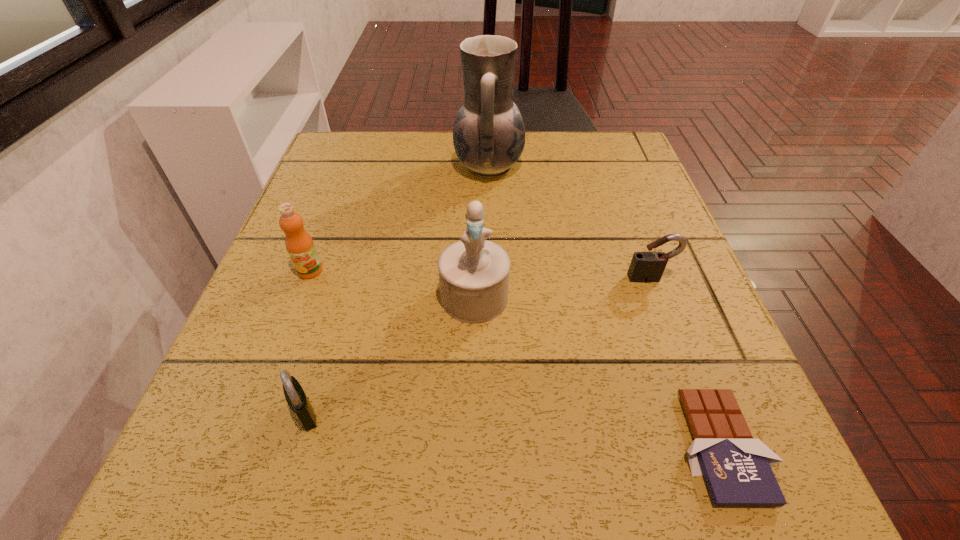
Locate an element on the screen. The width and height of the screenshot is (960, 540). free area in between the right padlock and the pitcher is located at coordinates (569, 222).

The image size is (960, 540). What are the coordinates of `blank region between the shortest object and the fifth object from right to left` in the screenshot? It's located at (514, 429).

The image size is (960, 540). What are the coordinates of `vacant space that's between the right padlock and the chocolate bar` in the screenshot? It's located at (686, 362).

Find the location of `free area in between the orange juice and the chocolate bar`. free area in between the orange juice and the chocolate bar is located at coordinates (516, 358).

You are a GUI agent. You are given a task and a screenshot of the screen. Output one action in this format:
    pyautogui.click(x=<x>, y=<y>)
    Task: Click on the vacant point located between the right padlock and the figurine
    The height and width of the screenshot is (540, 960).
    Given the screenshot: What is the action you would take?
    pyautogui.click(x=563, y=287)

This screenshot has width=960, height=540. Identify the location of unoccupied position between the farthest object and the nearer padlock. (396, 289).

Identify the location of free space between the figurine and the chocolate bar. This screenshot has width=960, height=540. (598, 372).

This screenshot has height=540, width=960. Find the location of `vacant area between the second tallest object and the left padlock`. vacant area between the second tallest object and the left padlock is located at coordinates (390, 355).

Where is `empty space between the nearer padlock and the tallest object`? The width and height of the screenshot is (960, 540). empty space between the nearer padlock and the tallest object is located at coordinates (396, 289).

Identify which object is the fourth closest to the second tallest object. Please provide its 2D coordinates. Your answer should be formatted as a tuple, i.e. [(x, y)], where the tuple contains the x and y coordinates of a point satisfying the conditions above.

[(737, 469)]